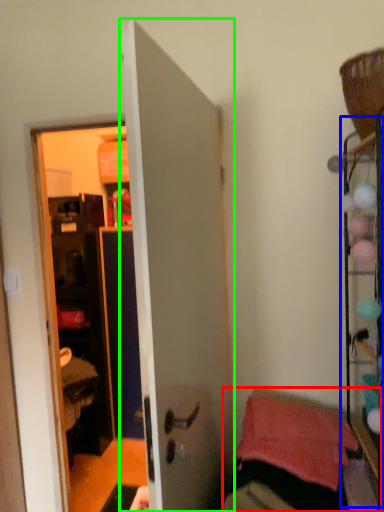
Question: Based on their relative distances, which object is nearer to furniture (highlighted by a red box)? Choose from shelf (highlighted by a blue box) and door (highlighted by a green box).

Choices:
 (A) shelf
 (B) door

Answer: (A)